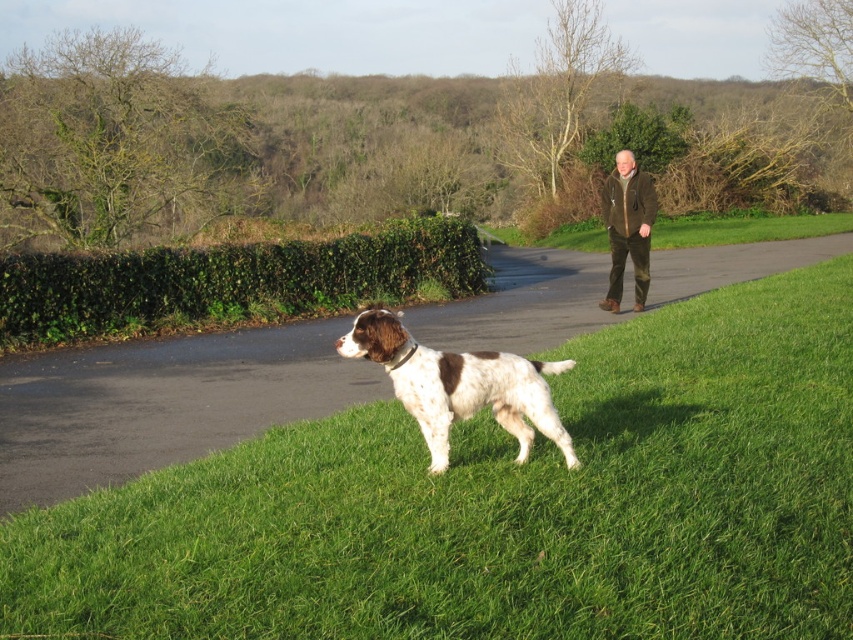
Image resolution: width=853 pixels, height=640 pixels. Identify the location of brown and white speckled dog at center. 459,385.

Does brown and white speckled dog at center have a greater height compared to brown leather jacket at upper right?

Yes, brown and white speckled dog at center is taller than brown leather jacket at upper right.

Does point (405, 406) come in front of point (635, 163)?

Yes, point (405, 406) is in front of point (635, 163).

This screenshot has height=640, width=853. I want to click on brown and white speckled dog at center, so 459,385.

Is green asphalt path at center taller than brown and white speckled dog at center?

Yes, green asphalt path at center is taller than brown and white speckled dog at center.

Is green asphalt path at center to the left of brown and white speckled dog at center from the viewer's perspective?

No, green asphalt path at center is not to the left of brown and white speckled dog at center.

At what (x,y) coordinates should I click in order to perform the action: click on green asphalt path at center. Please return your answer as a coordinate pair (x, y). The image size is (853, 640). Looking at the image, I should click on (161, 403).

Where is `green asphalt path at center`? The height and width of the screenshot is (640, 853). green asphalt path at center is located at coordinates (161, 403).

Who is taller, green asphalt path at center or brown leather jacket at upper right?

green asphalt path at center is taller.

Is point (109, 465) farther from camera compared to point (650, 212)?

That is False.

Who is more forward, (146, 435) or (622, 188)?

Point (146, 435) is in front.

Locate an element on the screen. This screenshot has height=640, width=853. green asphalt path at center is located at coordinates (161, 403).